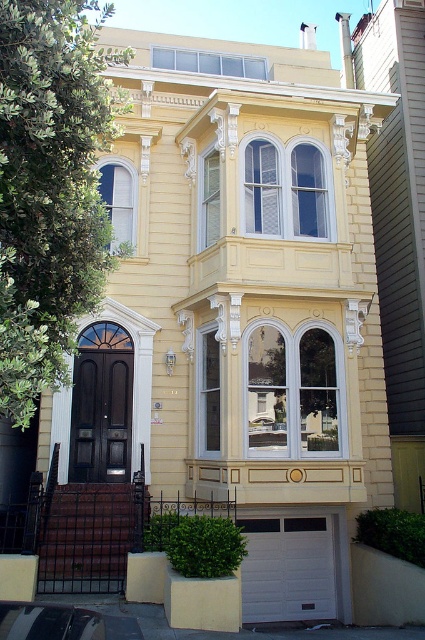
Which of these two, matte glass bay window at center or matte white window at upper left, stands taller?

matte glass bay window at center

Does matte glass bay window at center have a lesser width compared to matte white window at upper left?

In fact, matte glass bay window at center might be wider than matte white window at upper left.

Who is more distant from viewer, (x=252, y=401) or (x=107, y=204)?

Point (x=107, y=204)

Where is `matte glass bay window at center`? Image resolution: width=425 pixels, height=640 pixels. matte glass bay window at center is located at coordinates (294, 390).

Which is more to the right, clear glass window at upper center or matte white window at upper left?

Positioned to the right is clear glass window at upper center.

Identify the location of clear glass window at upper center. (209, 61).

Where is `clear glass window at upper center`? This screenshot has height=640, width=425. clear glass window at upper center is located at coordinates (209, 61).

Is matte glass bay window at center thinner than clear glass window at upper center?

Correct, matte glass bay window at center's width is less than clear glass window at upper center's.

Can you confirm if matte glass bay window at center is taller than clear glass window at upper center?

Yes.

Based on the photo, who is more distant from viewer, [303,342] or [212,61]?

The point [212,61] is more distant.

I want to click on matte glass bay window at center, so click(294, 390).